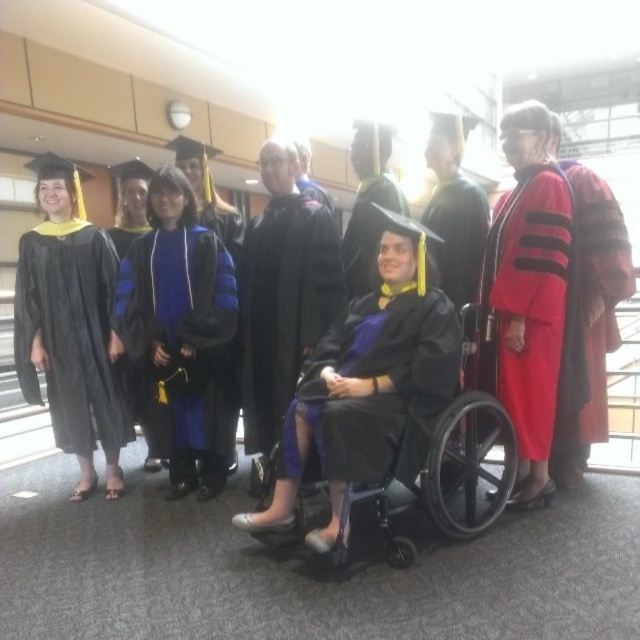
You are standing at the entrance of the graduation ceremony venue and want to locate the graduate wearing the matte black gown at center. According to the coordinates provided, where should you look to find them?

The graduate wearing the matte black gown at center is located at coordinates point (378, 392).